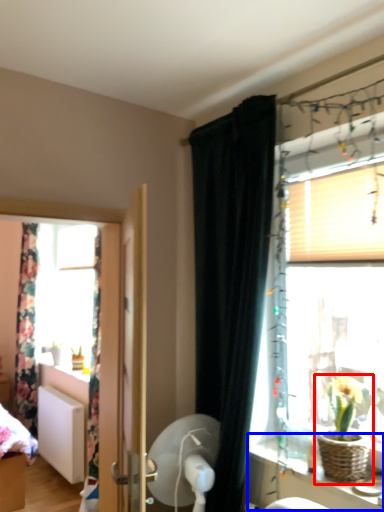
Question: Which point is further to the camera, houseplant (highlighted by a red box) or vanity (highlighted by a blue box)?

Choices:
 (A) houseplant
 (B) vanity

Answer: (A)